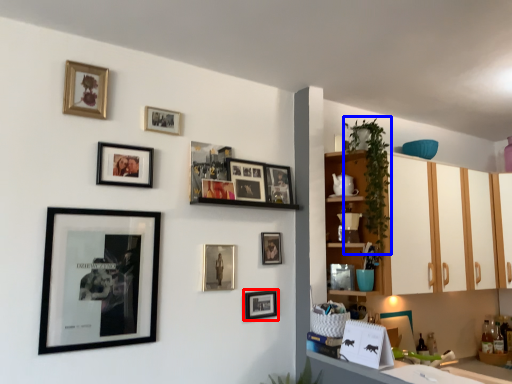
Question: Among these objects, which one is farthest to the camera, picture frame (highlighted by a red box) or plant (highlighted by a blue box)?

Choices:
 (A) picture frame
 (B) plant

Answer: (B)